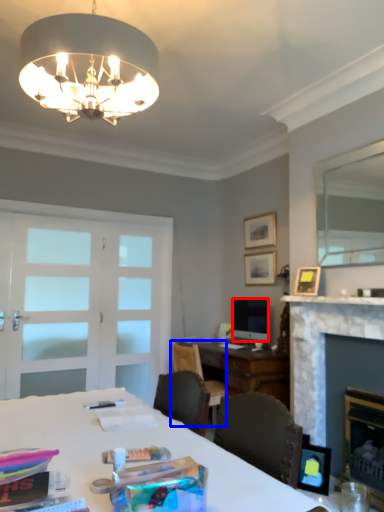
Question: Which object is further to the camera taking this photo, television (highlighted by a red box) or chair (highlighted by a blue box)?

Choices:
 (A) television
 (B) chair

Answer: (A)